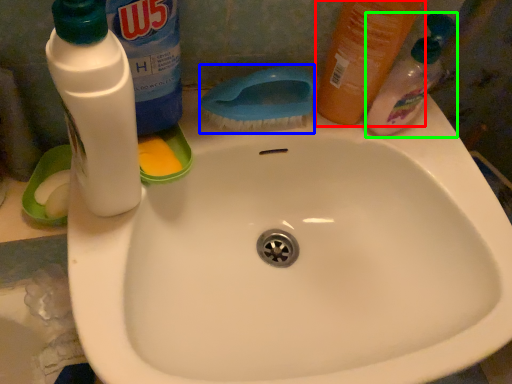
Question: Estimate the real-world distances between objects in this image. Which object is closer to cleaning product (highlighted by a red box), brush (highlighted by a blue box) or cleaning product (highlighted by a green box)?

Choices:
 (A) brush
 (B) cleaning product

Answer: (B)